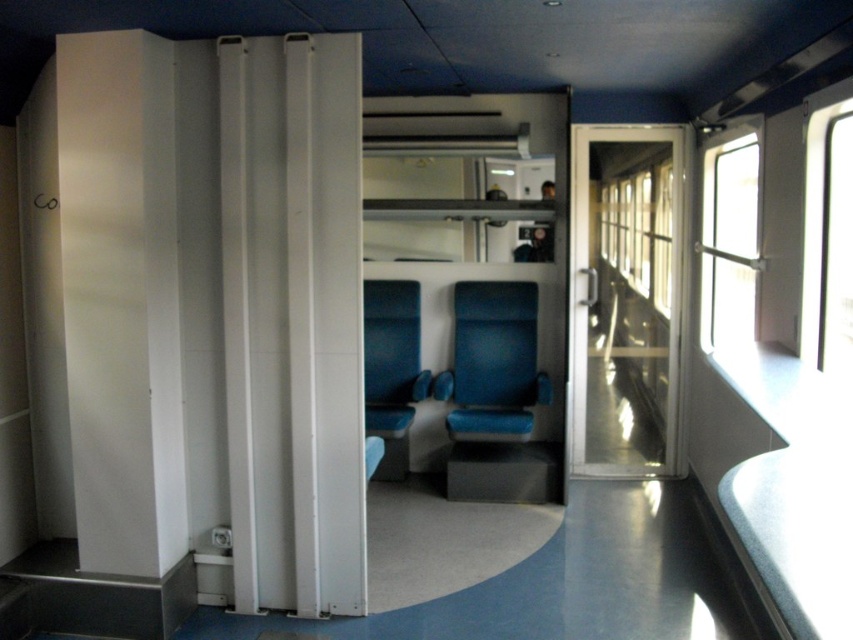
Question: Among these points, which one is farthest from the camera?

Choices:
 (A) (527, 250)
 (B) (469, 305)

Answer: (A)

Question: Does blue fabric chair at center come behind metallic silver coach at center?

Choices:
 (A) yes
 (B) no

Answer: (B)

Question: Based on their relative distances, which object is farther from the blue fabric chair at center?

Choices:
 (A) metallic silver coach at center
 (B) matte blue seat at center

Answer: (A)

Question: Does blue fabric chair at center appear on the left side of metallic silver coach at center?

Choices:
 (A) yes
 (B) no

Answer: (A)

Question: Among these objects, which one is farthest from the camera?

Choices:
 (A) matte blue seat at center
 (B) blue fabric chair at center
 (C) metallic silver coach at center

Answer: (C)

Question: Is blue fabric chair at center to the left of metallic silver coach at center from the viewer's perspective?

Choices:
 (A) yes
 (B) no

Answer: (A)